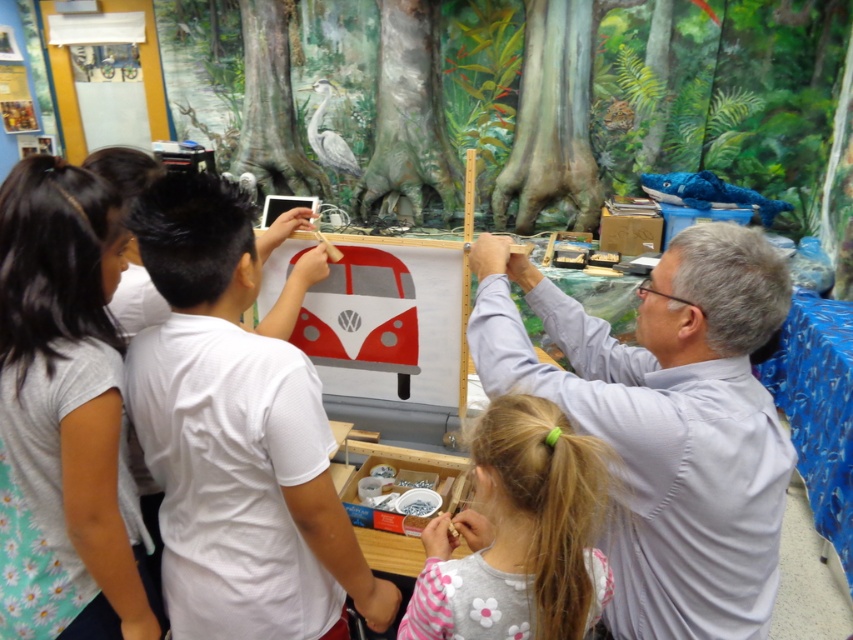
Can you confirm if gray shirt at upper right is taller than pastel pink fabric at lower center?

Yes, gray shirt at upper right is taller than pastel pink fabric at lower center.

Which is below, gray shirt at upper right or pastel pink fabric at lower center?

A: pastel pink fabric at lower center is lower down.

The image size is (853, 640). Describe the element at coordinates (665, 422) in the screenshot. I see `gray shirt at upper right` at that location.

Identify the location of gray shirt at upper right. (665, 422).

Image resolution: width=853 pixels, height=640 pixels. What do you see at coordinates (665, 422) in the screenshot? I see `gray shirt at upper right` at bounding box center [665, 422].

Can you confirm if gray shirt at upper right is wider than white matte shirt at center?

Yes.

The image size is (853, 640). What do you see at coordinates (665, 422) in the screenshot?
I see `gray shirt at upper right` at bounding box center [665, 422].

Find the location of `gray shirt at upper right`. gray shirt at upper right is located at coordinates (665, 422).

Which is behind, point (126, 504) or point (560, 436)?

Positioned behind is point (126, 504).

I want to click on light gray t-shirt at left, so click(64, 416).